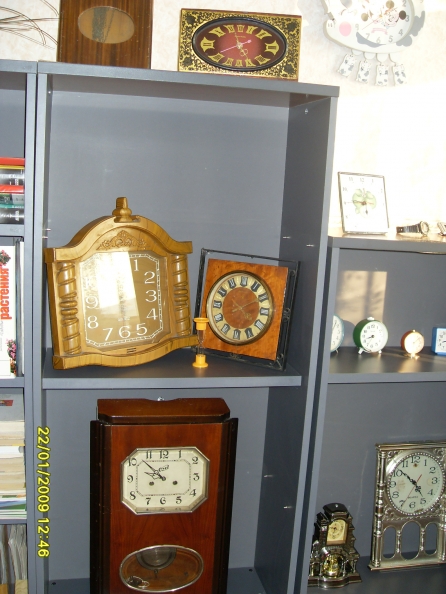
In order to click on dangling legs (?) on dog wall clock in this screenshot , I will do `click(348, 65)`, `click(362, 75)`, `click(380, 77)`, `click(402, 75)`.